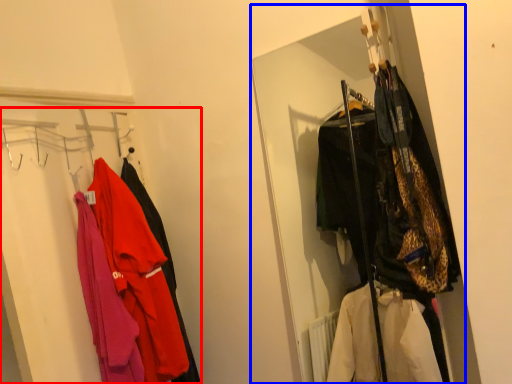
Question: Among these objects, which one is farthest to the camera, closet (highlighted by a red box) or closet (highlighted by a blue box)?

Choices:
 (A) closet
 (B) closet

Answer: (A)